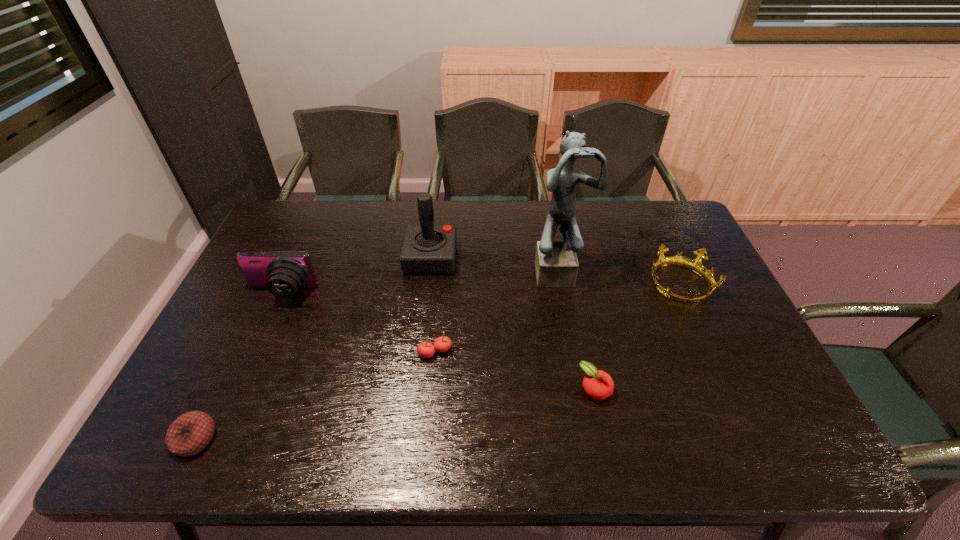
Where is `sculpture`? sculpture is located at coordinates (556, 264).

Locate an element on the screen. joystick is located at coordinates (427, 248).

Identify the location of camera. The width and height of the screenshot is (960, 540). 283,273.

Locate an element on the screen. The image size is (960, 540). the rightmost object is located at coordinates (695, 265).

This screenshot has height=540, width=960. Identify the location of the fifth farthest object. (442, 344).

The image size is (960, 540). I want to click on the second nearest object, so click(598, 385).

Identify the location of the nearest object. (190, 433).

Find the location of a particular element. vacant space situated on the face of the sculpture is located at coordinates (565, 306).

Where is `vacant space located on the base of the joystick`? Image resolution: width=960 pixels, height=540 pixels. vacant space located on the base of the joystick is located at coordinates (491, 258).

Identify the location of free space located on the front-facing side of the camera. The image size is (960, 540). (264, 330).